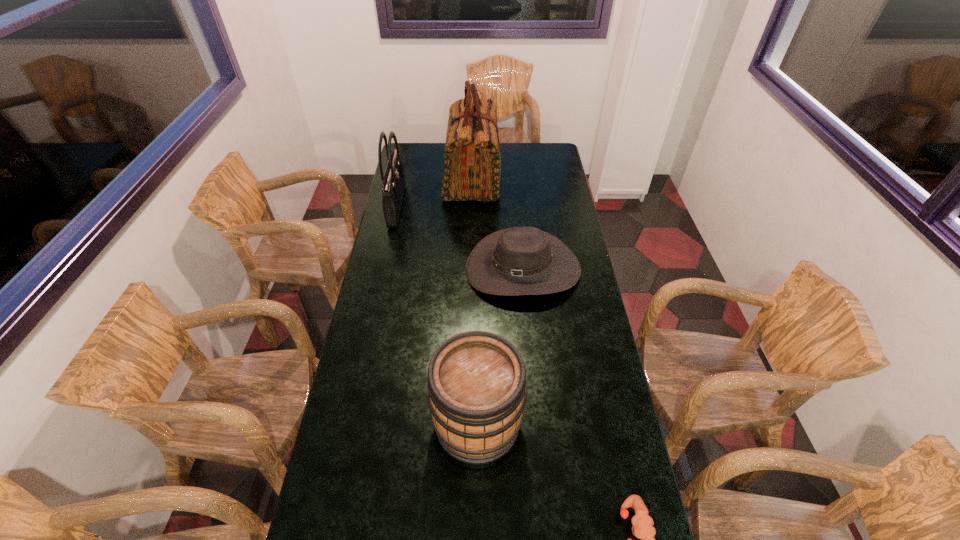
Where is `shopping bag`? shopping bag is located at coordinates (472, 164).

Locate an element on the screen. This screenshot has width=960, height=540. handbag is located at coordinates 393,182.

This screenshot has width=960, height=540. Identify the location of the second tallest object. (393, 182).

Image resolution: width=960 pixels, height=540 pixels. I want to click on cider, so click(x=476, y=392).

Locate an element on the screen. The width and height of the screenshot is (960, 540). the third shortest object is located at coordinates (476, 392).

I want to click on the second shortest object, so click(516, 261).

Where is `the third farthest object`? Image resolution: width=960 pixels, height=540 pixels. the third farthest object is located at coordinates (516, 261).

Locate an element on the screen. This screenshot has height=540, width=960. vacant space located 0.230m on the open handle side of the shopping bag is located at coordinates (549, 179).

Find the location of a particular element. The width and height of the screenshot is (960, 540). vacant space located 0.290m with an open clasp on the front of the fourth shortest object is located at coordinates (467, 205).

Where is `vacant area situated on the right of the cider`? vacant area situated on the right of the cider is located at coordinates click(x=623, y=423).